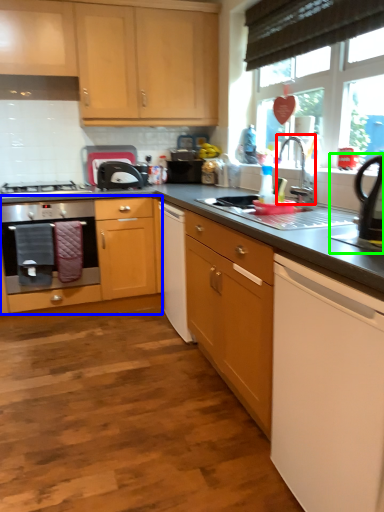
Question: Which is nearer to the tap (highlighted by a red box)? cabinetry (highlighted by a blue box) or appliance (highlighted by a green box).

Choices:
 (A) cabinetry
 (B) appliance

Answer: (B)